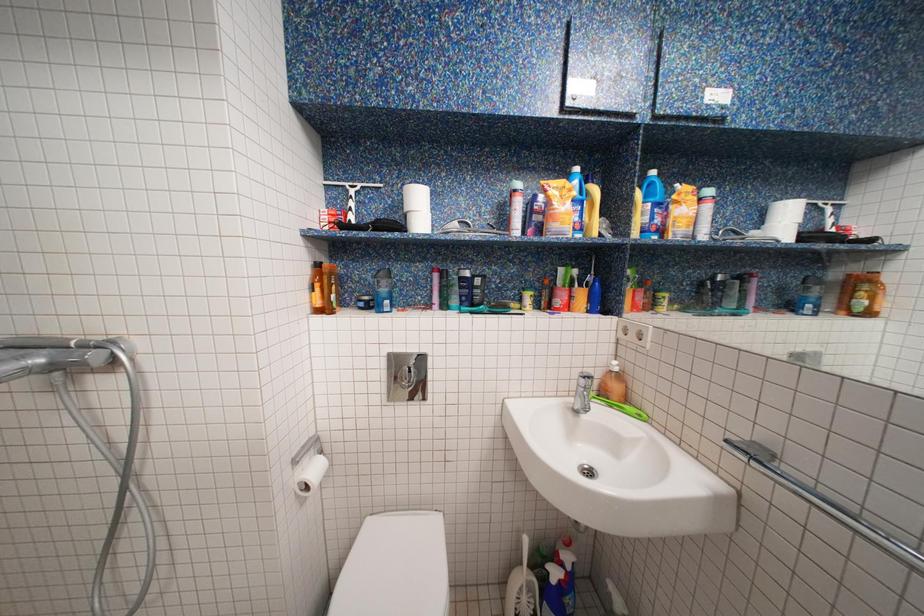
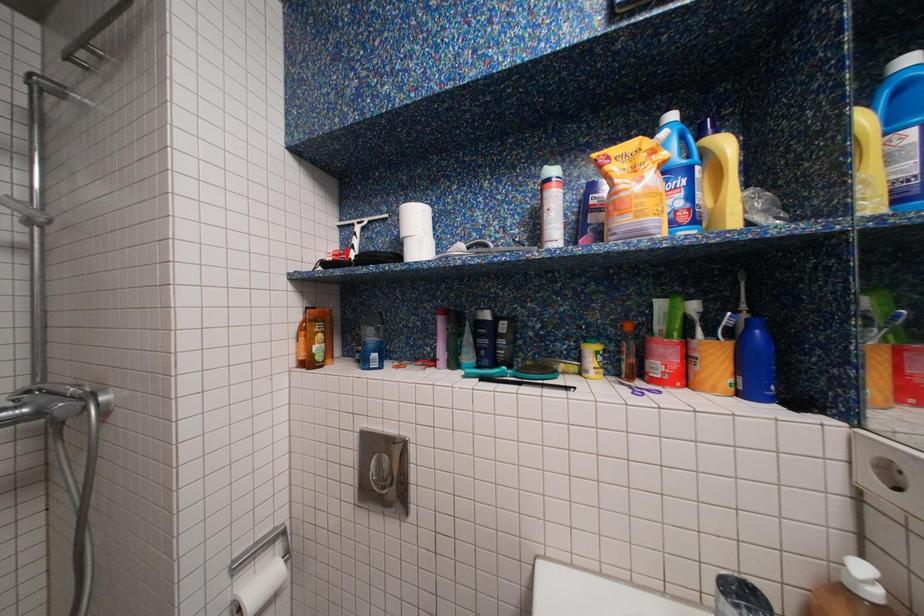
Question: The camera is either moving clockwise (left) or counter-clockwise (right) around the object. The first image is from the beginning of the video and the second image is from the end. Is the camera moving left or right when shooting the video?

Choices:
 (A) Left
 (B) Right

Answer: (B)